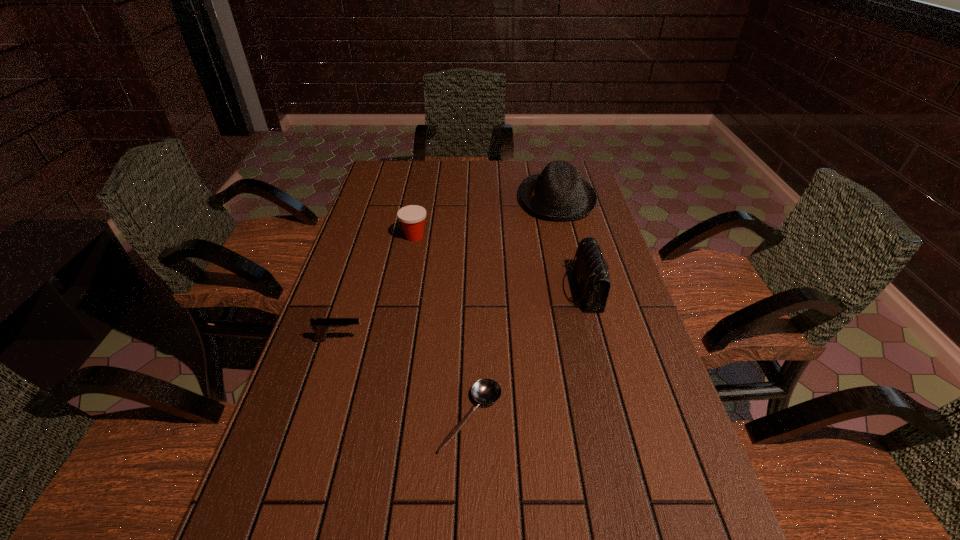
Where is `the farthest object`? The image size is (960, 540). the farthest object is located at coordinates (559, 193).

Where is `clutch bag`? The image size is (960, 540). clutch bag is located at coordinates pyautogui.click(x=591, y=272).

Locate an element on the screen. This screenshot has height=540, width=960. Dixie cup is located at coordinates (412, 217).

This screenshot has height=540, width=960. What are the coordinates of `the second farthest object` in the screenshot? It's located at (412, 217).

Locate an element on the screen. The height and width of the screenshot is (540, 960). the leftmost object is located at coordinates (320, 325).

I want to click on the fourth tallest object, so click(x=320, y=325).

Locate an element on the screen. The height and width of the screenshot is (540, 960). ladle is located at coordinates tap(485, 391).

This screenshot has height=540, width=960. I want to click on the shortest object, so click(485, 391).

I want to click on free spot located on the front-facing side of the fedora, so click(x=486, y=200).

Where is `vacant space located 0.250m on the front-facing side of the fedora`? This screenshot has height=540, width=960. vacant space located 0.250m on the front-facing side of the fedora is located at coordinates (448, 200).